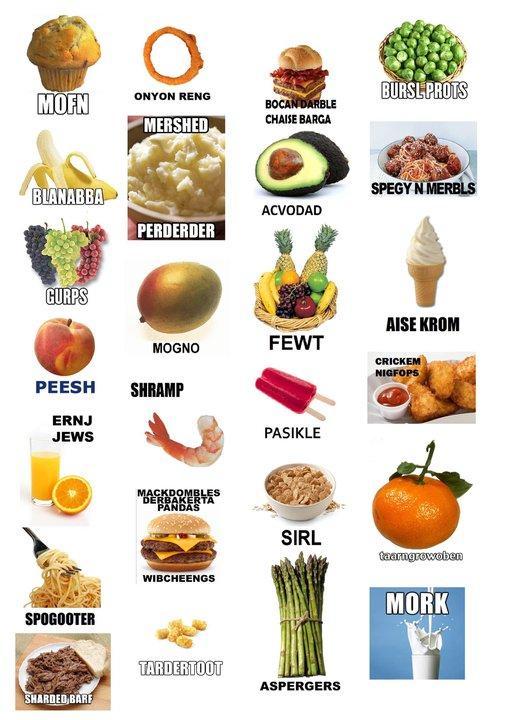
Find the location of a particular element. column 1 is located at coordinates (262, 517), (65, 9).